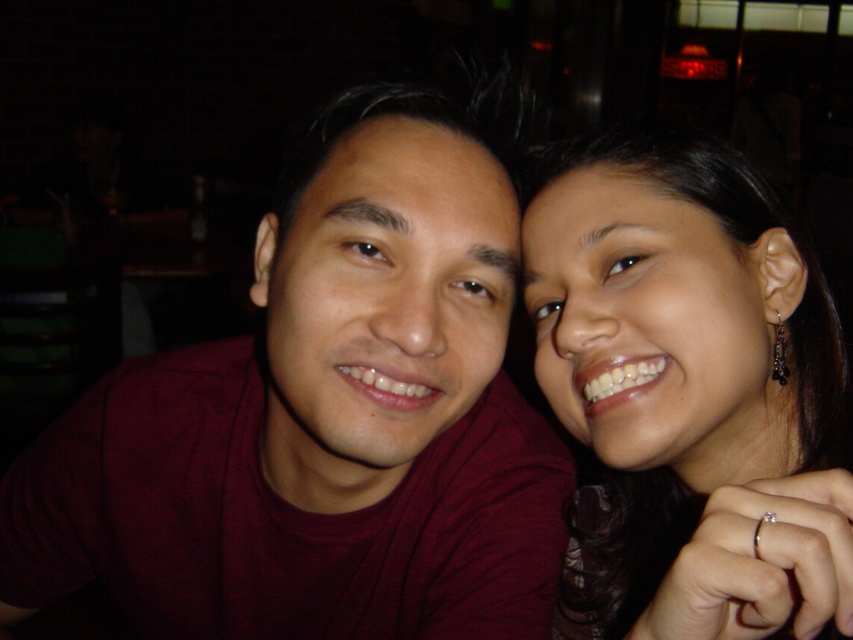
Question: Which of the following is the closest to the observer?

Choices:
 (A) smooth skin face at right
 (B) maroon t-shirt at center

Answer: (A)

Question: Which point appears farthest from the camera in this image?

Choices:
 (A) (758, 196)
 (B) (206, 624)

Answer: (B)

Question: Observing the image, what is the correct spatial positioning of maroon t-shirt at center in reference to smooth skin face at right?

Choices:
 (A) above
 (B) below

Answer: (B)

Question: Which point is farther from the camera taking this photo?

Choices:
 (A) (122, 554)
 (B) (820, 332)

Answer: (A)

Question: Can you confirm if maroon t-shirt at center is positioned to the right of smooth skin face at right?

Choices:
 (A) yes
 (B) no

Answer: (B)

Question: Does maroon t-shirt at center have a larger size compared to smooth skin face at right?

Choices:
 (A) yes
 (B) no

Answer: (A)